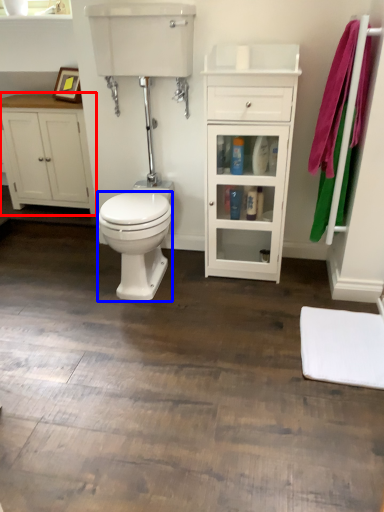
Question: Among these objects, which one is farthest to the camera, bathroom cabinet (highlighted by a red box) or bidet (highlighted by a blue box)?

Choices:
 (A) bathroom cabinet
 (B) bidet

Answer: (A)